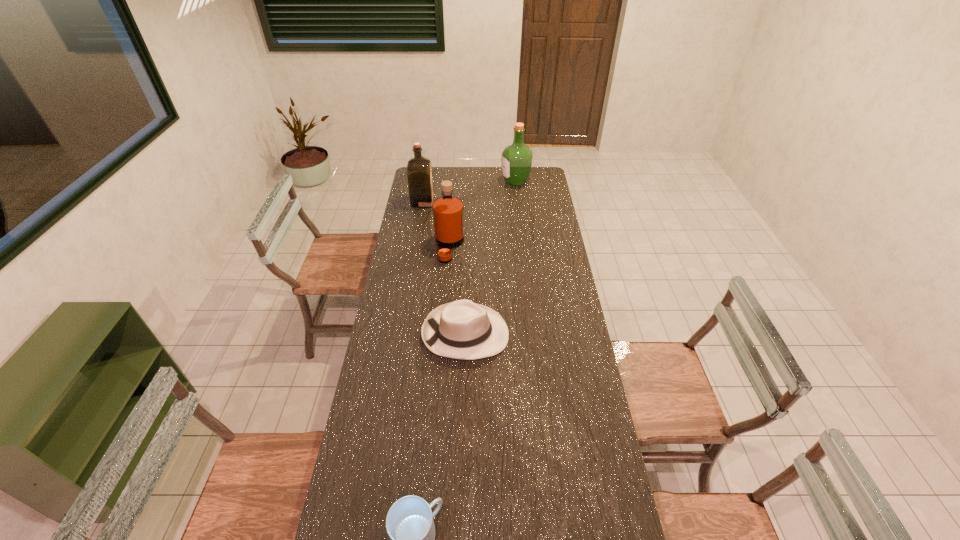
Where is `vacant space located 0.330m on the label of the second nearest liquor`? The image size is (960, 540). vacant space located 0.330m on the label of the second nearest liquor is located at coordinates (495, 201).

The image size is (960, 540). Find the location of `vacant region located 0.150m on the front label of the third nearest object`. vacant region located 0.150m on the front label of the third nearest object is located at coordinates (496, 247).

Find the location of a particular element. This screenshot has height=540, width=960. vacant area located on the front-facing side of the fedora is located at coordinates (576, 334).

This screenshot has height=540, width=960. What are the coordinates of `object located in the far edge section of the desktop` in the screenshot? It's located at [x=516, y=164].

Find the location of a particular element. The height and width of the screenshot is (540, 960). object located in the left edge section of the desktop is located at coordinates (419, 169).

Where is `object present at the right edge`? object present at the right edge is located at coordinates (516, 164).

This screenshot has height=540, width=960. I want to click on object that is at the far right corner, so click(x=516, y=164).

Find the location of a particular element. The width and height of the screenshot is (960, 540). vacant space at the far edge of the desktop is located at coordinates (455, 176).

The image size is (960, 540). Identify the location of free space at the left edge of the desktop. (381, 311).

Locate an element on the screen. blank space at the right edge of the desktop is located at coordinates (605, 464).